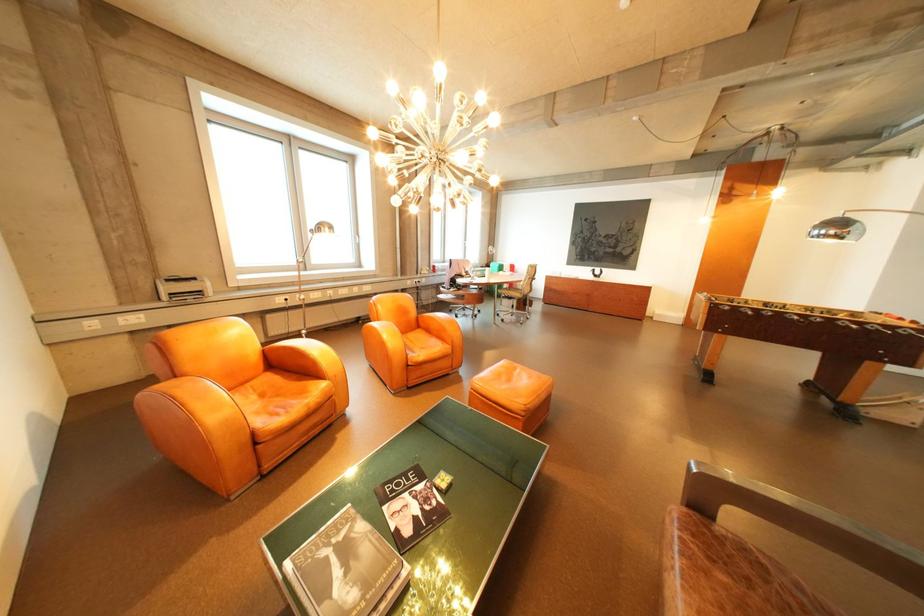
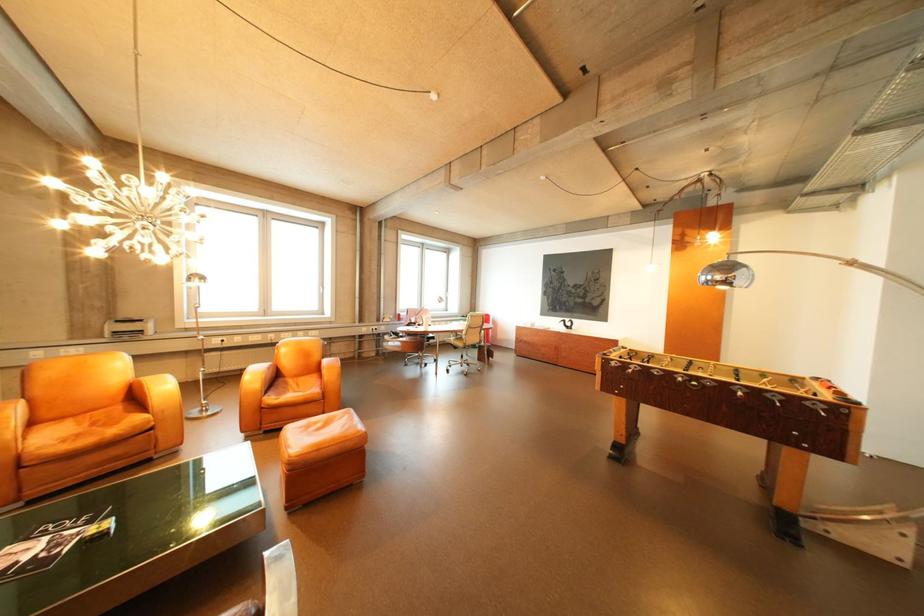
Question: Which direction would the cameraman need to move to produce the second image? Reply with the corresponding letter.

Choices:
 (A) Left
 (B) Right
 (C) Forward
 (D) Backward

Answer: (B)